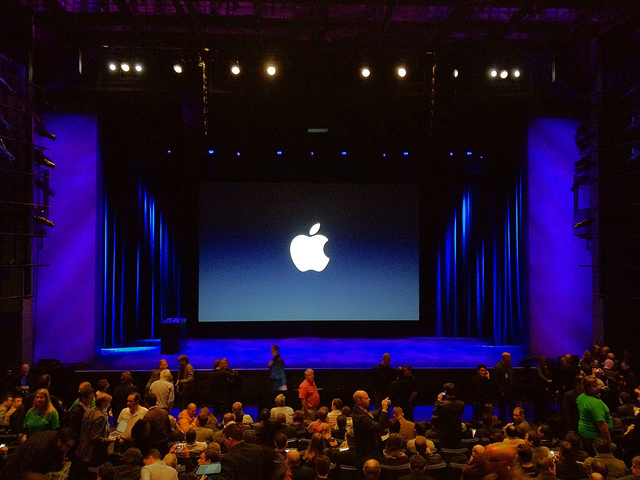
What are the coordinates of `curtains` in the screenshot? It's located at (139, 290), (466, 276).